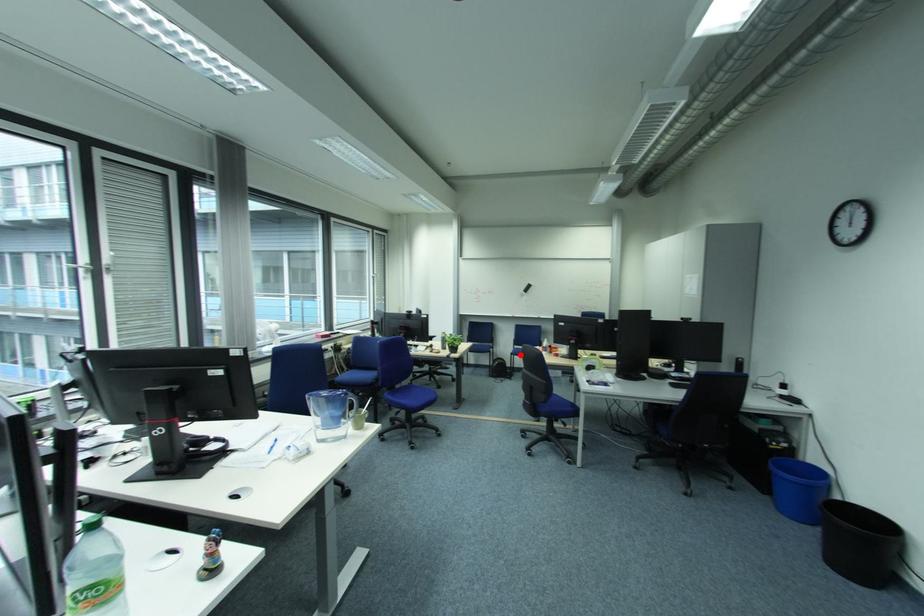
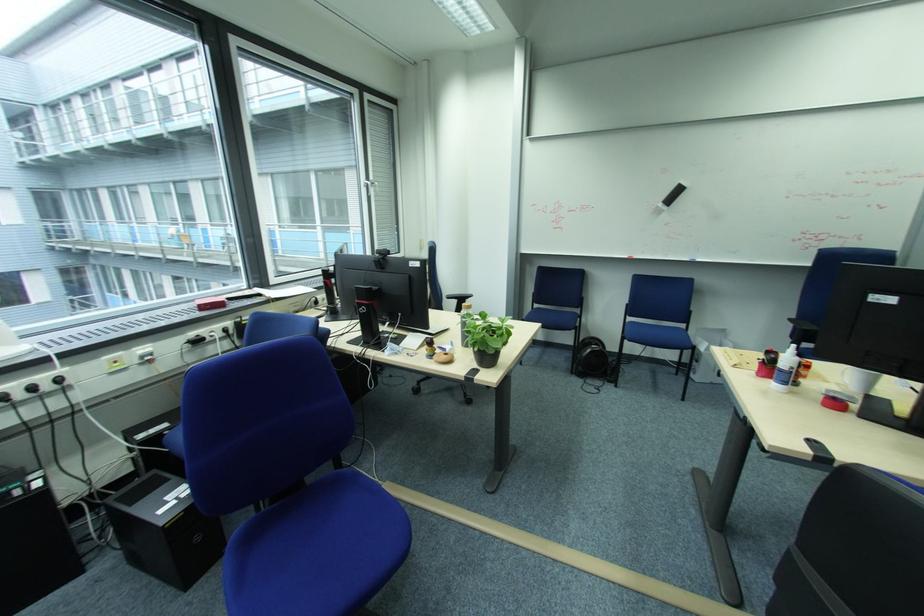
The point at the highlighted location is marked in the first image. Where is the corresponding point in the second image?

(633, 339)